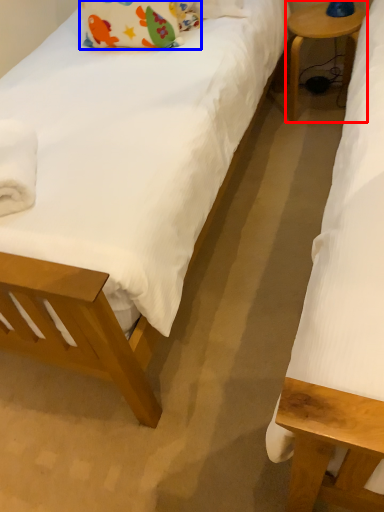
Question: Which of the following is the farthest to the observer, table (highlighted by a red box) or pillow (highlighted by a blue box)?

Choices:
 (A) table
 (B) pillow

Answer: (A)